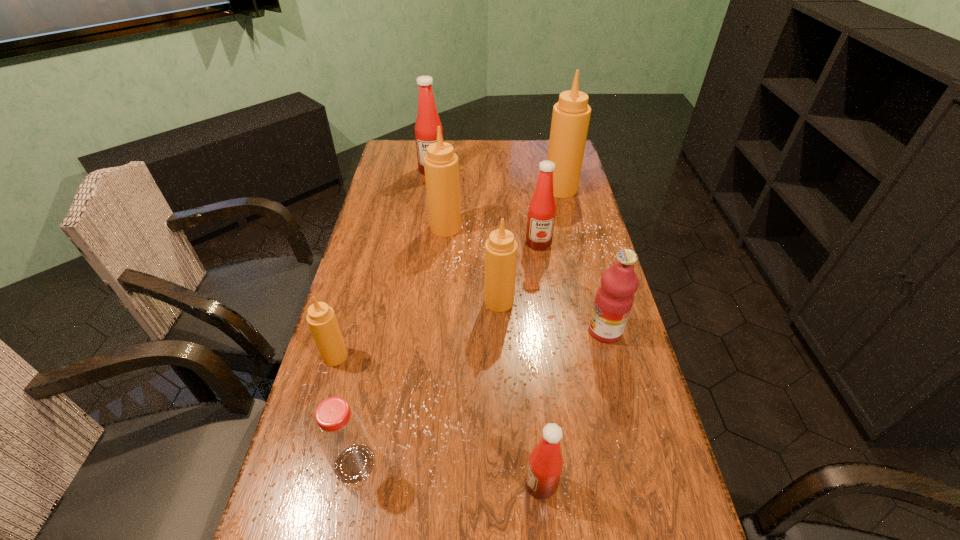
Locate which red condiment ranks in proximity to the nearest condiment. Please provide its 2D coordinates. Your answer should be formatted as a tuple, i.e. [(x, y)], where the tuple contains the x and y coordinates of a point satisfying the conditions above.

[(541, 214)]

Locate an element on the screen. free spot that satisfies the following two spatial constraints: 1. on the front-facing side of the second farthest red condiment; 2. on the front-facing side of the smallest red condiment is located at coordinates (574, 484).